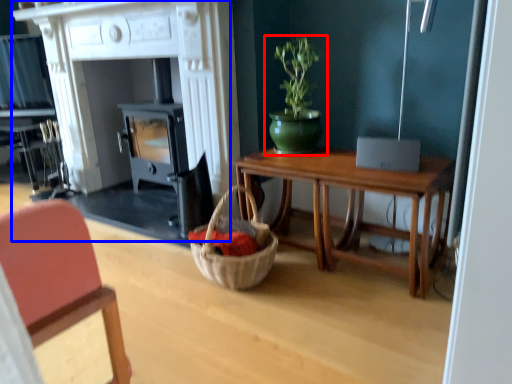
Question: Among these objects, which one is nearest to the camera, houseplant (highlighted by a red box) or fireplace (highlighted by a blue box)?

Choices:
 (A) houseplant
 (B) fireplace

Answer: (B)